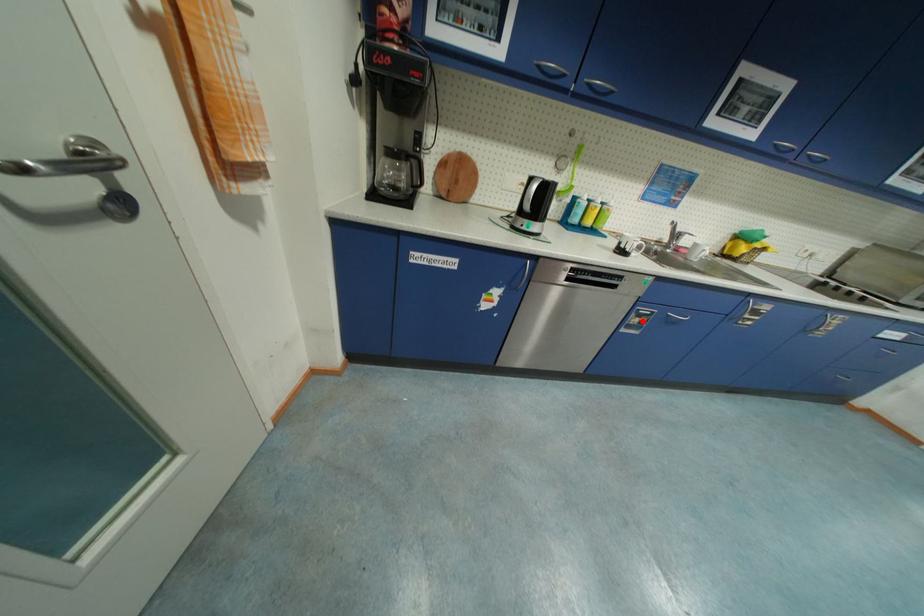
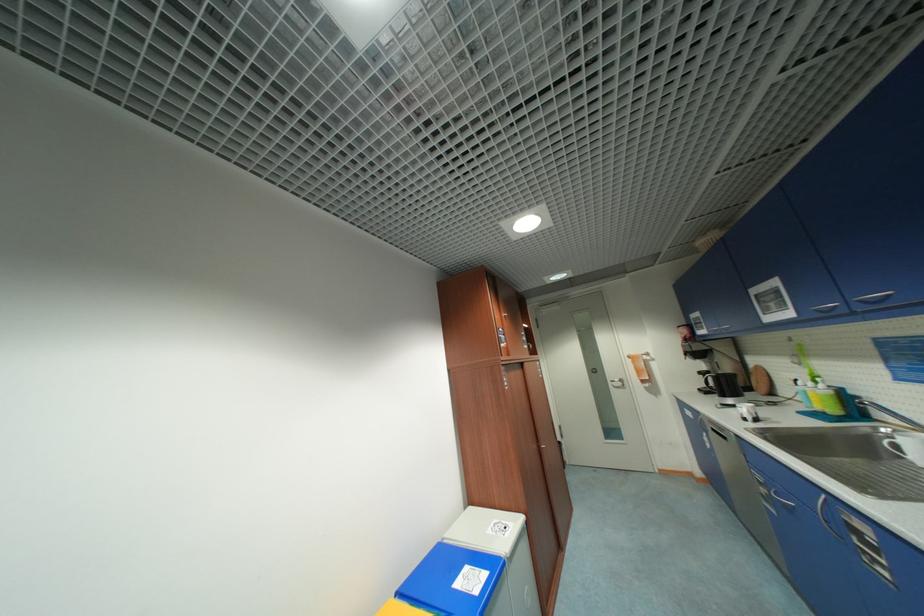
Find the pixel in the second image that matches the highlighted location in the first image.

(768, 491)